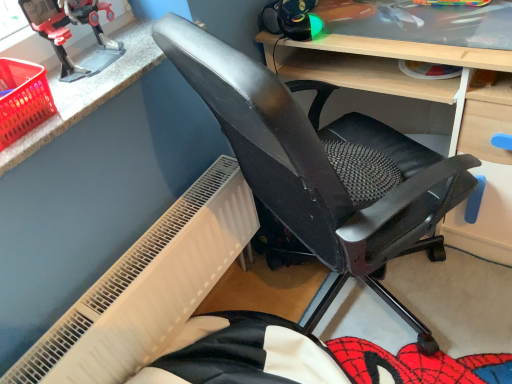
Locate an element on the screen. This screenshot has height=384, width=512. free spot below metallic plastic toy robot at upper left (from a real-world perspective) is located at coordinates (100, 66).